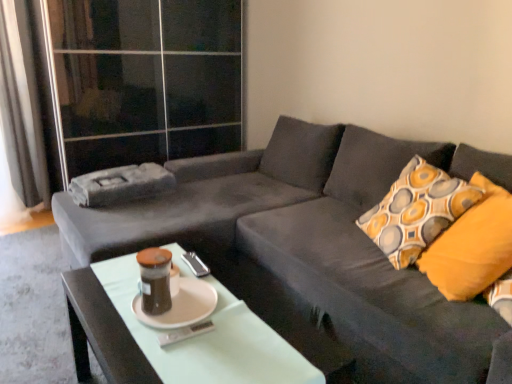
Where is `white matte saucer at center`? white matte saucer at center is located at coordinates (181, 306).

What do you see at coordinates (22, 106) in the screenshot? This screenshot has height=384, width=512. I see `gray fabric curtain at left` at bounding box center [22, 106].

Describe the element at coordinates (146, 79) in the screenshot. I see `transparent glass door at upper left` at that location.

What is the approximate height of velvet dark gray couch at center?

It is 32.64 inches.

What do you see at coordinates (311, 249) in the screenshot?
I see `velvet dark gray couch at center` at bounding box center [311, 249].

Where is `white matte saucer at center`? white matte saucer at center is located at coordinates (181, 306).

From a real-world perspective, is patterned fabric pillow at right on transparent glass door at upper left?

No, from a real-world perspective, patterned fabric pillow at right is not above transparent glass door at upper left.

Can you confirm if patterned fabric pillow at right is shorter than transparent glass door at upper left?

Yes.

Which object is positioned more to the left, patterned fabric pillow at right or transparent glass door at upper left?

transparent glass door at upper left is more to the left.

Identify the location of curtain positioned vertically above the white glossy coffee table at center (from a real-world perspective). (22, 106).

Is gray fabric curtain at left to the right of white glossy coffee table at center from the viewer's perspective?

No.

Can you confirm if gray fabric curtain at left is shorter than white glossy coffee table at center?

Incorrect, the height of gray fabric curtain at left does not fall short of that of white glossy coffee table at center.

Find the location of a particular element. The image size is (512, 384). studio couch to the right of white glossy coffee table at center is located at coordinates (311, 249).

From the image's perspective, which is below, velvet dark gray couch at center or white glossy coffee table at center?

white glossy coffee table at center appears lower in the image.

Based on their positions, is velvet dark gray couch at center located to the left or right of white glossy coffee table at center?

Based on their positions, velvet dark gray couch at center is located to the right of white glossy coffee table at center.

Is velvet dark gray couch at center positioned behind white glossy coffee table at center?

No, velvet dark gray couch at center is closer to the viewer.

Considering the positions of objects patterned fabric pillow at right and velvet dark gray couch at center in the image provided, who is more to the left, patterned fabric pillow at right or velvet dark gray couch at center?

velvet dark gray couch at center.

Which object is wider, patterned fabric pillow at right or velvet dark gray couch at center?

With larger width is velvet dark gray couch at center.

Which is less distant, (452,287) or (353,176)?

Point (452,287) is positioned closer to the camera compared to point (353,176).

Locate an element on the screen. This screenshot has height=384, width=512. studio couch below the patterned fabric pillow at right (from a real-world perspective) is located at coordinates (311, 249).

Which is behind, point (292, 366) or point (170, 258)?

The point (170, 258) is more distant.

Is teal glass jar at center at the back of white glossy coffee table at center?

A: No, white glossy coffee table at center's orientation is not away from teal glass jar at center.

Which object is positioned more to the left, white glossy coffee table at center or teal glass jar at center?

teal glass jar at center.

Considering the sizes of objects teal glass jar at center and gray fabric curtain at left in the image provided, who is bigger, teal glass jar at center or gray fabric curtain at left?

With larger size is gray fabric curtain at left.

How different are the orientations of teal glass jar at center and gray fabric curtain at left in degrees?

teal glass jar at center and gray fabric curtain at left are facing 92.4 degrees away from each other.

From the picture: Is teal glass jar at center positioned far away from gray fabric curtain at left?

Yes, teal glass jar at center and gray fabric curtain at left are quite far apart.

Is gray fabric curtain at left located within teal glass jar at center?

Actually, gray fabric curtain at left is outside teal glass jar at center.

Which of these two, velvet dark gray couch at center or white matte saucer at center, is bigger?

With larger size is velvet dark gray couch at center.

Do you think velvet dark gray couch at center is within white matte saucer at center, or outside of it?

velvet dark gray couch at center cannot be found inside white matte saucer at center.

Is velvet dark gray couch at center touching white matte saucer at center?

No, velvet dark gray couch at center is not making contact with white matte saucer at center.

From a real-world perspective, does velvet dark gray couch at center stand above white matte saucer at center?

Actually, velvet dark gray couch at center is physically below white matte saucer at center in the real world.

Identify the location of glass door above the patterned fabric pillow at right (from a real-world perspective). The image size is (512, 384). (146, 79).

At what (x,y) coordinates should I click in order to perform the action: click on coffee table on the right of gray fabric curtain at left. Please return your answer as a coordinate pair (x, y). The height and width of the screenshot is (384, 512). Looking at the image, I should click on (206, 338).

Based on their spatial positions, is white glossy coffee table at center or teal glass jar at center further from gray fabric curtain at left?

Based on the image, teal glass jar at center appears to be further to gray fabric curtain at left.

Considering their positions, is white matte saucer at center positioned closer to white glossy coffee table at center than transparent glass door at upper left?

Among the two, white matte saucer at center is located nearer to white glossy coffee table at center.

Based on their spatial positions, is white glossy coffee table at center or velvet dark gray couch at center further from transparent glass door at upper left?

The object further to transparent glass door at upper left is white glossy coffee table at center.

Based on their spatial positions, is gray fabric curtain at left or velvet dark gray couch at center further from patterned fabric pillow at right?

Based on the image, gray fabric curtain at left appears to be further to patterned fabric pillow at right.

When comparing their distances from patterned fabric pillow at right, does white matte saucer at center or teal glass jar at center seem closer?

The object closer to patterned fabric pillow at right is white matte saucer at center.

Based on their spatial positions, is velvet dark gray couch at center or teal glass jar at center further from white glossy coffee table at center?

velvet dark gray couch at center is further to white glossy coffee table at center.

Consider the image. Which object lies nearer to the anchor point patterned fabric pillow at right, teal glass jar at center or white glossy coffee table at center?

white glossy coffee table at center is positioned closer to the anchor patterned fabric pillow at right.

Considering their positions, is patterned fabric pillow at right positioned closer to velvet dark gray couch at center than white glossy coffee table at center?

patterned fabric pillow at right is positioned closer to the anchor velvet dark gray couch at center.

The width and height of the screenshot is (512, 384). In order to click on glass door located between white matte saucer at center and gray fabric curtain at left in the depth direction in this screenshot , I will do `click(146, 79)`.

I want to click on glass door between gray fabric curtain at left and patterned fabric pillow at right from left to right, so click(x=146, y=79).

In order to click on teal between velvet dark gray couch at center and transparent glass door at upper left along the z-axis in this screenshot , I will do `click(155, 280)`.

You are a GUI agent. You are given a task and a screenshot of the screen. Output one action in this format:
    pyautogui.click(x=<x>, y=<y>)
    Task: Click on the saucer between velvet dark gray couch at center and transparent glass door at upper left along the z-axis
    This screenshot has height=384, width=512.
    Given the screenshot: What is the action you would take?
    pyautogui.click(x=181, y=306)